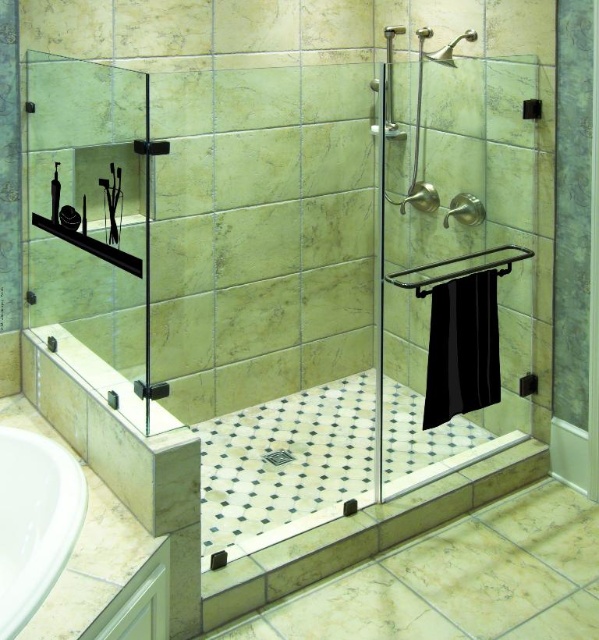
Question: Which object appears farthest from the camera in this image?

Choices:
 (A) clear glass shower door at right
 (B) black matte towel bar at upper center

Answer: (B)

Question: Is clear glass shower door at right wider than black matte towel bar at upper center?

Choices:
 (A) no
 (B) yes

Answer: (B)

Question: Which object is positioned farthest from the white ceramic bathtub at lower left?

Choices:
 (A) black matte towel bar at upper center
 (B) clear glass shower door at right
 (C) satin nickel showerhead at upper center
 (D) white glossy screen door at lower left

Answer: (C)

Question: Is clear glass shower door at right behind satin nickel showerhead at upper center?

Choices:
 (A) no
 (B) yes

Answer: (A)

Question: Which object appears closest to the camera in this image?

Choices:
 (A) white glossy screen door at lower left
 (B) clear glass shower door at right

Answer: (A)

Question: Is white ceramic bathtub at lower left positioned behind white glossy screen door at lower left?

Choices:
 (A) yes
 (B) no

Answer: (B)